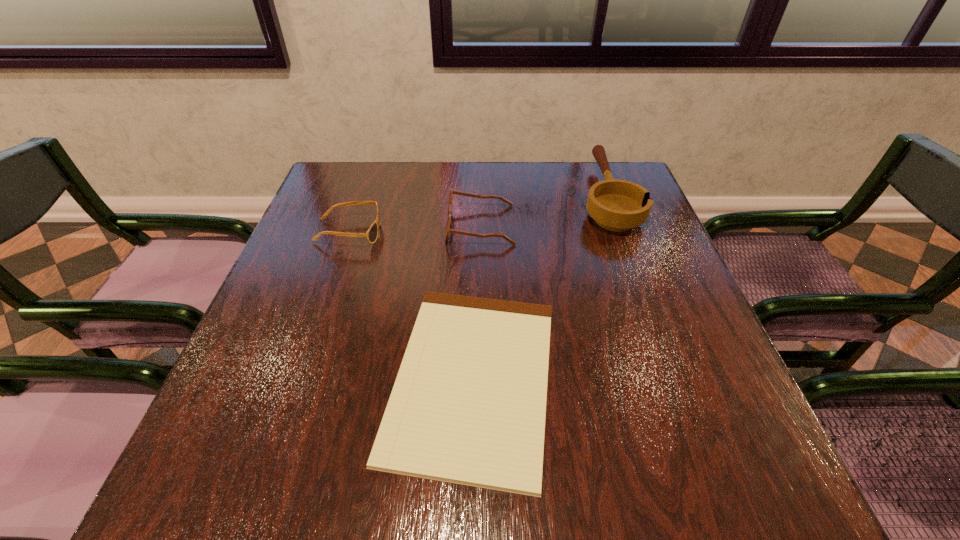
I want to click on blank area located 0.270m on the right of the shortest object, so click(x=709, y=377).

Find the location of `saucepan positioned at the far edge`. saucepan positioned at the far edge is located at coordinates (617, 205).

The height and width of the screenshot is (540, 960). What are the coordinates of `spectacles at the far edge` in the screenshot? It's located at (448, 230).

Locate an element on the screen. This screenshot has height=540, width=960. object positioned at the near edge is located at coordinates (468, 406).

This screenshot has width=960, height=540. What are the coordinates of `object that is at the left edge` in the screenshot? It's located at (371, 235).

At what (x,y) coordinates should I click in order to perform the action: click on object that is at the right edge. Please return your answer as a coordinate pair (x, y). This screenshot has width=960, height=540. Looking at the image, I should click on (617, 205).

Where is `object that is at the far right corner`? This screenshot has height=540, width=960. object that is at the far right corner is located at coordinates (617, 205).

Where is `vacant space at the far edge of the desktop`? The image size is (960, 540). vacant space at the far edge of the desktop is located at coordinates (431, 199).

The height and width of the screenshot is (540, 960). In order to click on vacant space at the near edge of the desktop in this screenshot , I will do `click(346, 475)`.

Locate an element on the screen. free space at the left edge of the desktop is located at coordinates (340, 212).